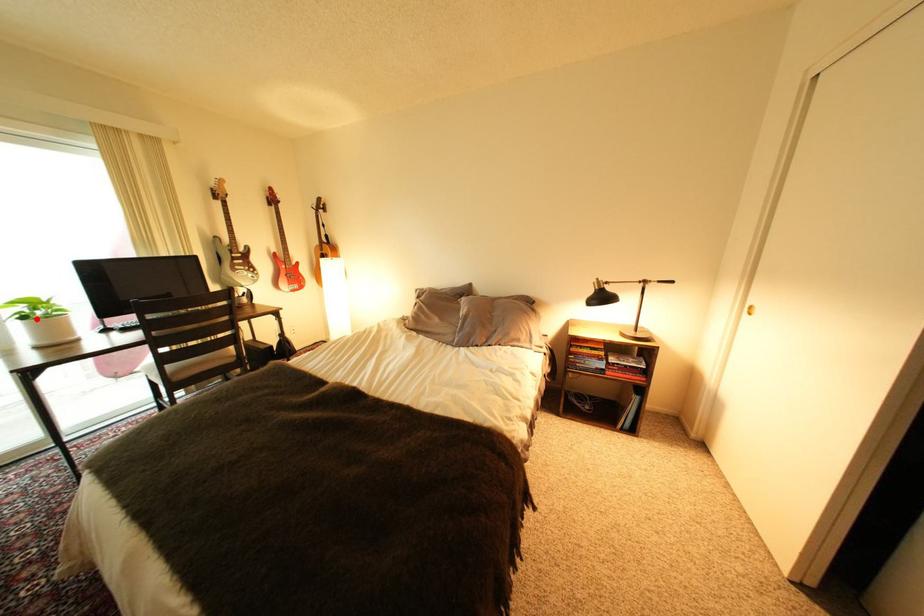
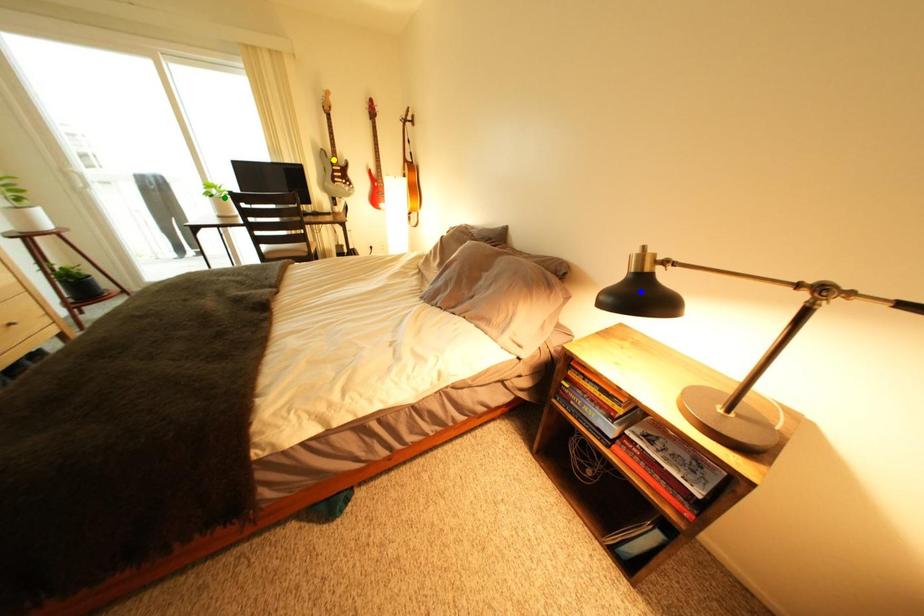
Question: I am providing you with two images of the same scene from different viewpoints. A red point is marked on the first image. You are given multiple points on the second image. In image 2, which mark is for the same physical point as the one in image 1?

Choices:
 (A) green point
 (B) blue point
 (C) yellow point

Answer: (A)